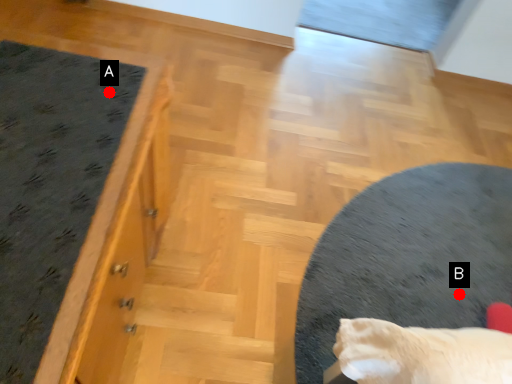
Question: Two points are circled on the image, labeled by A and B beside each circle. Which point is closer to the camera?

Choices:
 (A) A is closer
 (B) B is closer

Answer: (A)